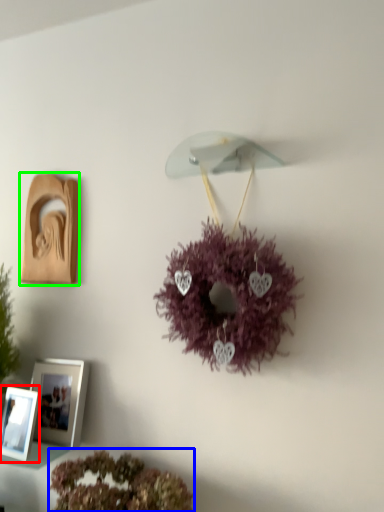
Question: Which is farther away from picture frame (highlighted by a red box)? flower (highlighted by a blue box) or picture frame (highlighted by a green box)?

Choices:
 (A) flower
 (B) picture frame

Answer: (B)